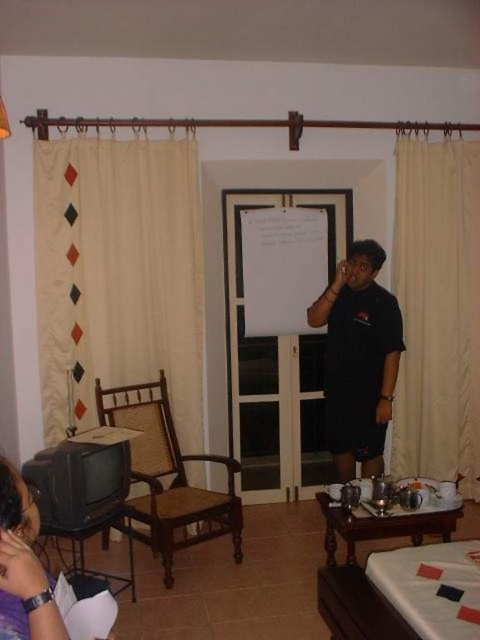
Is beige fabric curtain at left below beige fabric curtain at right?

No, beige fabric curtain at left is not below beige fabric curtain at right.

Is point (187, 269) positioned after point (447, 232)?

No, it is not.

Is point (142, 225) behind point (453, 300)?

No, it is in front of (453, 300).

Find the location of `beige fabric curtain at left`. beige fabric curtain at left is located at coordinates (118, 275).

Is beige fabric curtain at left in front of brown woven armchair at left?

No, it is behind brown woven armchair at left.

Is beige fabric curtain at left above brown woven armchair at left?

Correct, beige fabric curtain at left is located above brown woven armchair at left.

Find the location of a particular element. The width and height of the screenshot is (480, 640). beige fabric curtain at left is located at coordinates (118, 275).

This screenshot has width=480, height=640. Describe the element at coordinates (118, 275) in the screenshot. I see `beige fabric curtain at left` at that location.

Is beige fabric curtain at left taller than black matte shirt at center?

Yes, beige fabric curtain at left is taller than black matte shirt at center.

The width and height of the screenshot is (480, 640). What do you see at coordinates (118, 275) in the screenshot? I see `beige fabric curtain at left` at bounding box center [118, 275].

Where is `beige fabric curtain at left`? beige fabric curtain at left is located at coordinates (118, 275).